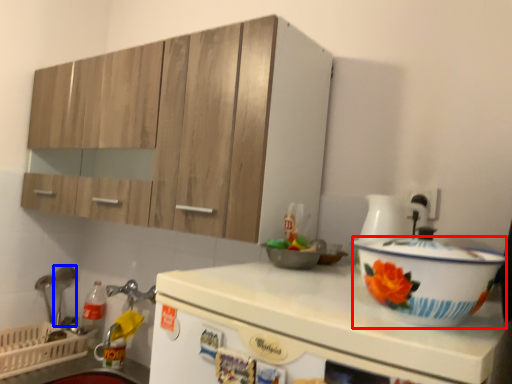
Question: Among these objects, which one is farthest to the camera, basin (highlighted by a red box) or tableware (highlighted by a blue box)?

Choices:
 (A) basin
 (B) tableware

Answer: (B)